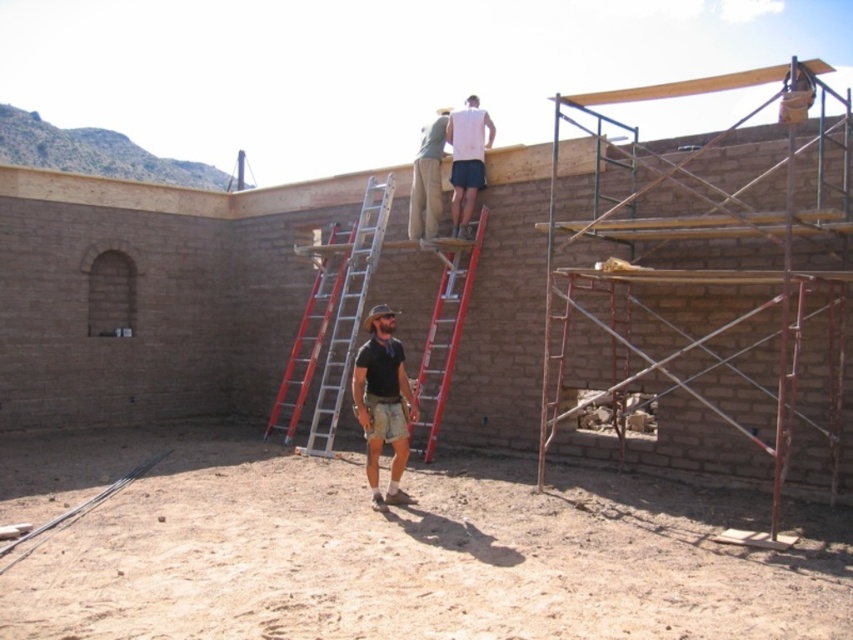
What is located at the coordinates point (381, 403) in the image?

The coordinates point (381, 403) marks dark brown leather boots at center.